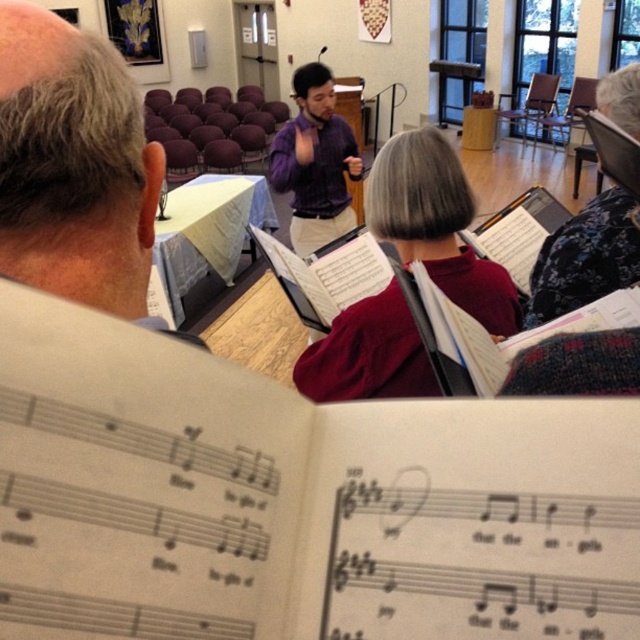
You are a stagehand setting up a microphone stand that is 2 meters long. You need to place it between the gray hair at upper left and the purple matte shirt at center. Will the microphone stand fit between them without overlapping either?

The distance between the gray hair at upper left and the purple matte shirt at center is 3.29 meters. Since the microphone stand is 2 meters long, it will fit between them with 1.29 meters of space remaining.

You are an event planner organizing a choir rehearsal. You need to decide which of the two items, the maroon sweater at center or the purple matte shirt at center, requires a larger storage space. Based on the scene description, which one should you allocate more space for?

The purple matte shirt at center requires more storage space because it is larger than the maroon sweater at center.

You are standing in the church and want to place a small gift exactly where the maroon sweater at center is located. What coordinates should you use?

The coordinates for the maroon sweater at center are 0.352 in the x direction and 0.684 in the y direction.